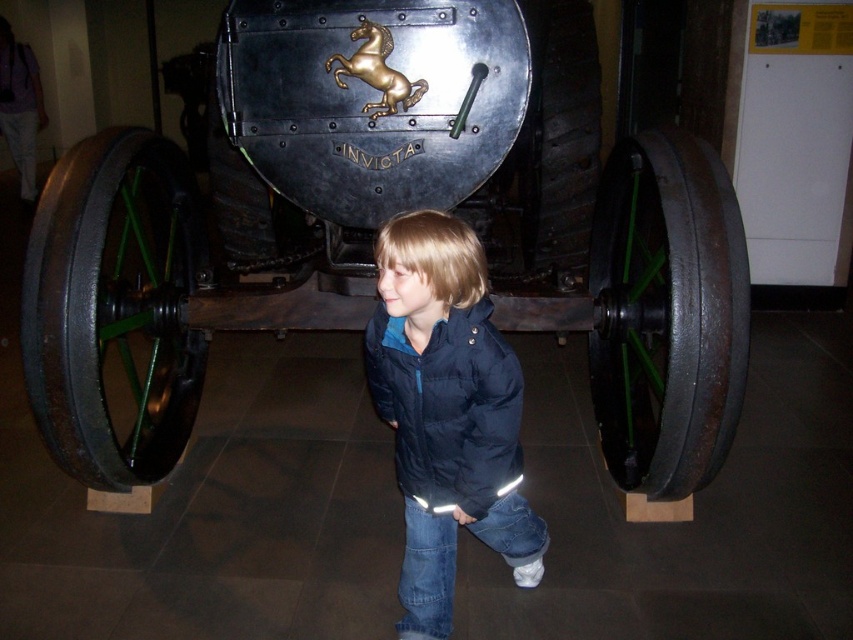
Question: In this image, where is polished metal cannon at center located relative to navy blue jacket at center?

Choices:
 (A) below
 (B) above

Answer: (B)

Question: Is polished metal cannon at center below navy blue jacket at center?

Choices:
 (A) yes
 (B) no

Answer: (B)

Question: Can you confirm if polished metal cannon at center is smaller than navy blue jacket at center?

Choices:
 (A) yes
 (B) no

Answer: (B)

Question: Which point is closer to the camera?

Choices:
 (A) (277, 68)
 (B) (485, 371)

Answer: (B)